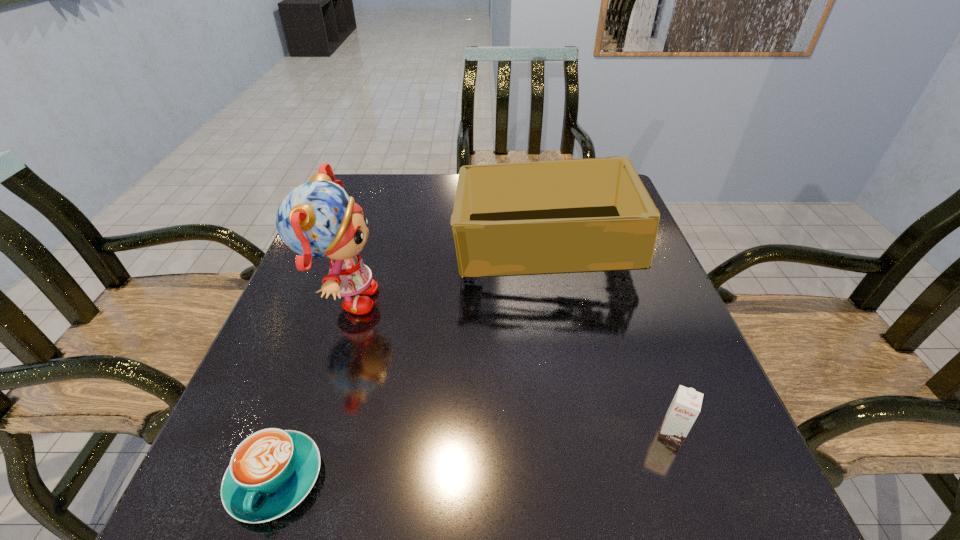
Where is `the tallest object`? This screenshot has width=960, height=540. the tallest object is located at coordinates (317, 219).

You are a GUI agent. You are given a task and a screenshot of the screen. Output one action in this format:
    pyautogui.click(x=<x>, y=<y>)
    Task: Click on the third shortest object
    The image size is (960, 540).
    Given the screenshot: What is the action you would take?
    pyautogui.click(x=587, y=215)

You are a GUI agent. You are given a task and a screenshot of the screen. Output one action in this format:
    pyautogui.click(x=<x>, y=<y>)
    Task: Click on the chocolate milk
    The width and height of the screenshot is (960, 540).
    Given the screenshot: What is the action you would take?
    pyautogui.click(x=685, y=407)

The width and height of the screenshot is (960, 540). In order to click on cappuccino in this screenshot , I will do `click(271, 471)`.

Locate an element on the screen. free spot located 0.240m on the face of the tallest object is located at coordinates (492, 301).

At what (x,y) coordinates should I click in order to perform the action: click on free space located 0.280m on the left of the box. Please return your answer as a coordinate pair (x, y). Looking at the image, I should click on (344, 246).

What are the coordinates of `free space located 0.190m on the back of the second shortest object` in the screenshot? It's located at (636, 335).

This screenshot has height=540, width=960. Identify the location of object that is at the far edge. (587, 215).

I want to click on object at the near edge, so click(271, 471).

The height and width of the screenshot is (540, 960). In order to click on doll that is at the left edge in this screenshot , I will do `click(317, 219)`.